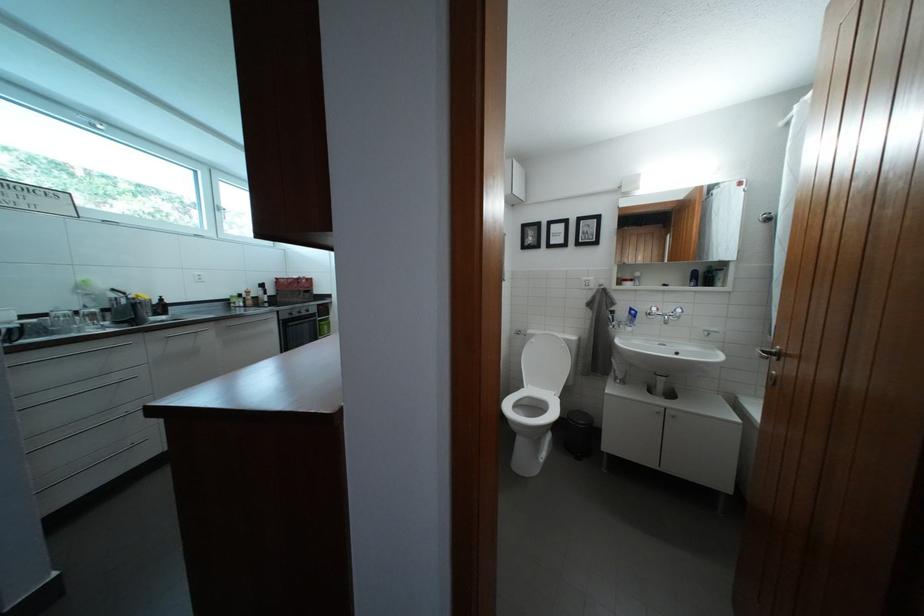
At what (x,y) coordinates should I click in order to perform the action: click on white window handle. Please return your answer as a coordinate pair (x, y). The image size is (924, 616). Looking at the image, I should click on (90, 122).